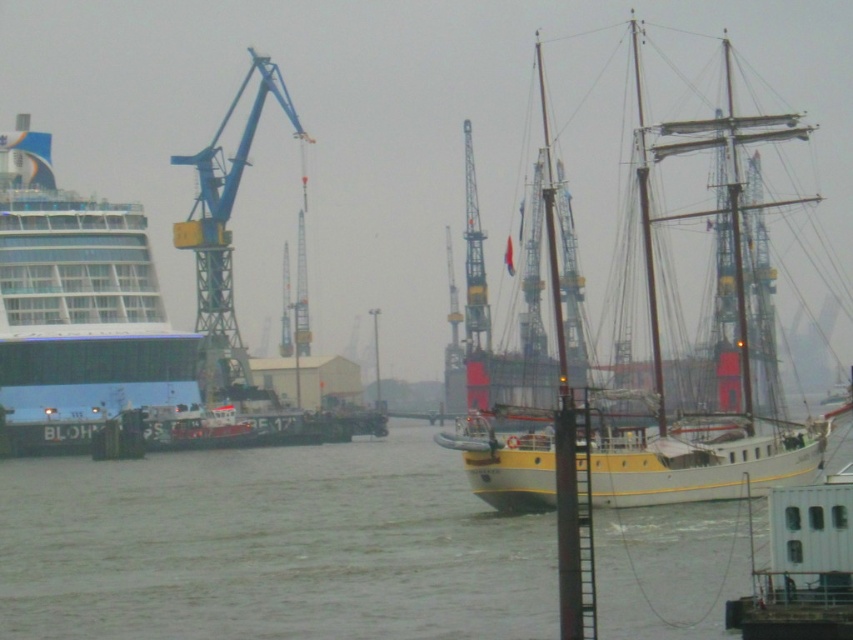
Looking at this image, is matte glass cruise ship at left thinner than blue metallic crane at left?

Yes, matte glass cruise ship at left is thinner than blue metallic crane at left.

Is matte glass cruise ship at left positioned in front of blue metallic crane at left?

Yes, it is in front of blue metallic crane at left.

The width and height of the screenshot is (853, 640). I want to click on matte glass cruise ship at left, so click(76, 308).

Between point (3, 212) and point (674, 460), which one is positioned behind?

Positioned behind is point (3, 212).

Between matte glass cruise ship at left and yellow polished wood sailboat at center, which one appears on the left side from the viewer's perspective?

From the viewer's perspective, matte glass cruise ship at left appears more on the left side.

Is point (94, 248) farther from camera compared to point (709, 481)?

That is True.

Where is `matte glass cruise ship at left`? This screenshot has width=853, height=640. matte glass cruise ship at left is located at coordinates (76, 308).

Is point (606, 481) farther from camera compared to point (230, 316)?

No, (606, 481) is closer to viewer.

Is point (720, 420) positioned in front of point (280, 99)?

Yes, it is in front of point (280, 99).

This screenshot has height=640, width=853. In order to click on yellow polished wood sailboat at center in this screenshot , I will do `click(733, 353)`.